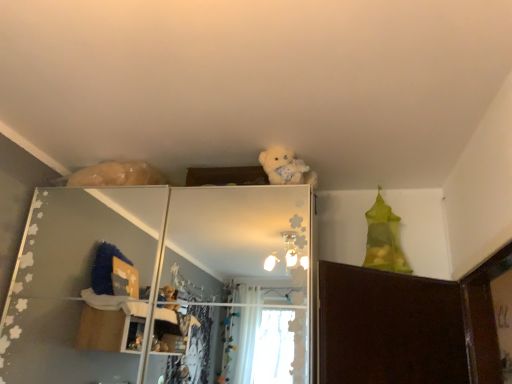
Question: Considering the relative sizes of fluffy white teddy bear at upper center and white glossy shelf at upper center in the image provided, is fluffy white teddy bear at upper center smaller than white glossy shelf at upper center?

Choices:
 (A) yes
 (B) no

Answer: (A)

Question: Is fluffy white teddy bear at upper center shorter than white glossy shelf at upper center?

Choices:
 (A) yes
 (B) no

Answer: (A)

Question: Is fluffy white teddy bear at upper center looking in the opposite direction of white glossy shelf at upper center?

Choices:
 (A) yes
 (B) no

Answer: (B)

Question: Could white glossy shelf at upper center be considered to be inside fluffy white teddy bear at upper center?

Choices:
 (A) yes
 (B) no

Answer: (B)

Question: Is fluffy white teddy bear at upper center at the right side of white glossy shelf at upper center?

Choices:
 (A) yes
 (B) no

Answer: (A)

Question: From a real-world perspective, is fluffy white teddy bear at upper center on white glossy shelf at upper center?

Choices:
 (A) no
 (B) yes

Answer: (B)

Question: Does white glossy shelf at upper center have a lesser height compared to fluffy white teddy bear at upper center?

Choices:
 (A) no
 (B) yes

Answer: (A)

Question: Is white glossy shelf at upper center wider than fluffy white teddy bear at upper center?

Choices:
 (A) no
 (B) yes

Answer: (B)

Question: Is white glossy shelf at upper center not near fluffy white teddy bear at upper center?

Choices:
 (A) no
 (B) yes

Answer: (B)

Question: Considering the relative positions of white glossy shelf at upper center and fluffy white teddy bear at upper center in the image provided, is white glossy shelf at upper center to the right of fluffy white teddy bear at upper center from the viewer's perspective?

Choices:
 (A) yes
 (B) no

Answer: (B)

Question: Is white glossy shelf at upper center further to camera compared to fluffy white teddy bear at upper center?

Choices:
 (A) yes
 (B) no

Answer: (B)

Question: Considering the relative sizes of white glossy shelf at upper center and fluffy white teddy bear at upper center in the image provided, is white glossy shelf at upper center taller than fluffy white teddy bear at upper center?

Choices:
 (A) no
 (B) yes

Answer: (B)

Question: Is point (268, 150) positioned closer to the camera than point (275, 200)?

Choices:
 (A) closer
 (B) farther

Answer: (B)